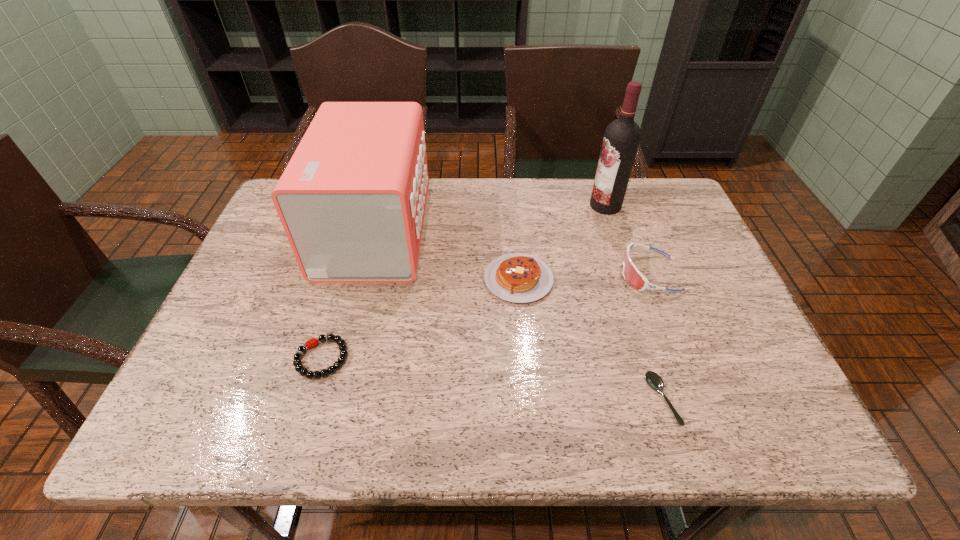
Locate an element on the screen. The height and width of the screenshot is (540, 960). vacant area that lies between the box and the soupspoon is located at coordinates (518, 315).

Locate an element on the screen. The height and width of the screenshot is (540, 960). unoccupied position between the second shortest object and the shortest object is located at coordinates (492, 379).

Find the location of `empty location between the tallest object and the third object from left to right`. empty location between the tallest object and the third object from left to right is located at coordinates (562, 242).

Locate an element on the screen. The image size is (960, 540). free spot between the fourth object from right to left and the tallest object is located at coordinates pyautogui.click(x=562, y=242).

Image resolution: width=960 pixels, height=540 pixels. I want to click on vacant space in between the goggles and the fifth tallest object, so click(486, 316).

Identify the location of empty location between the tallest object and the fourth object from right to left. The image size is (960, 540). (562, 242).

This screenshot has width=960, height=540. What are the coordinates of `free spot between the fourth object from right to left and the fourth shortest object` in the screenshot? It's located at (585, 277).

Image resolution: width=960 pixels, height=540 pixels. I want to click on vacant space that is in between the fifth tallest object and the tallest object, so click(464, 282).

The height and width of the screenshot is (540, 960). Find the location of `the third closest object to the fourth object from right to left`. the third closest object to the fourth object from right to left is located at coordinates tap(622, 136).

This screenshot has height=540, width=960. What are the coordinates of `the third closest object to the fourth shortest object` in the screenshot? It's located at (653, 379).